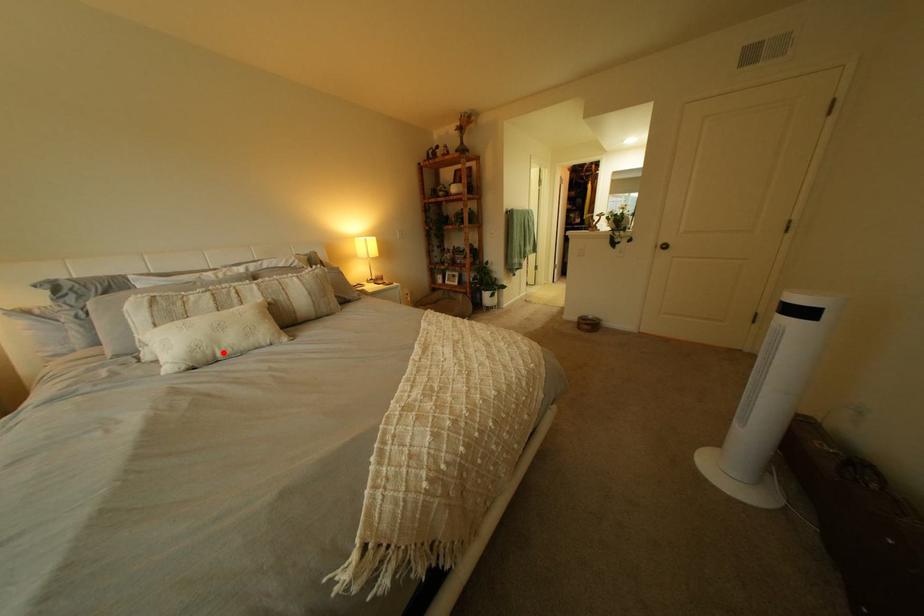
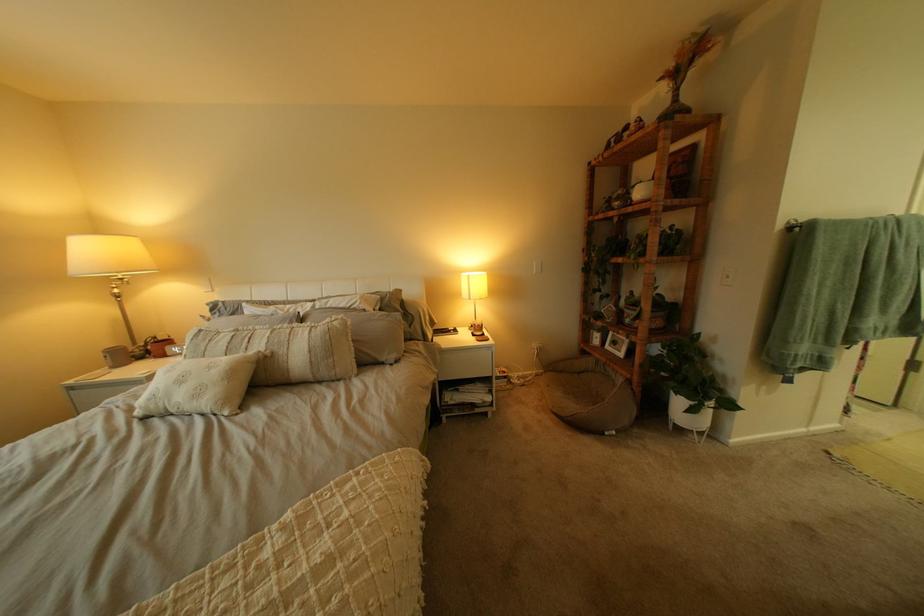
Where in the second image is the point corresponding to the highlighted location from the first image?

(176, 405)